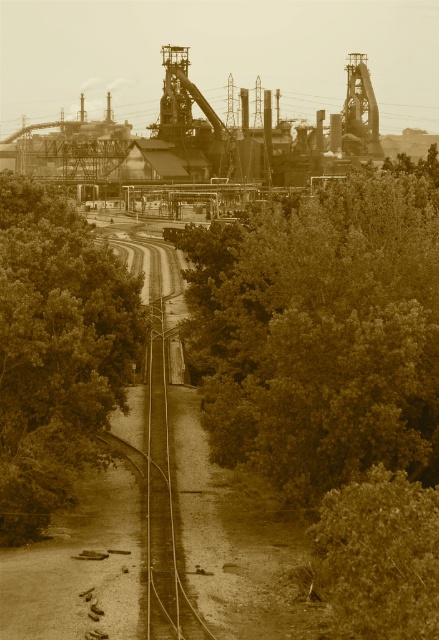
Question: Can you confirm if green leafy tree at center is wider than green leafy tree at left?

Choices:
 (A) no
 (B) yes

Answer: (B)

Question: Which of the following is the farthest from the observer?

Choices:
 (A) (49, 508)
 (B) (279, 416)

Answer: (A)

Question: Which object is farther from the camera taking this photo?

Choices:
 (A) green leafy tree at center
 (B) green leafy tree at left

Answer: (B)

Question: Does green leafy tree at center appear on the left side of green leafy tree at left?

Choices:
 (A) no
 (B) yes

Answer: (A)

Question: Can you confirm if green leafy tree at center is positioned below green leafy tree at left?

Choices:
 (A) no
 (B) yes

Answer: (A)